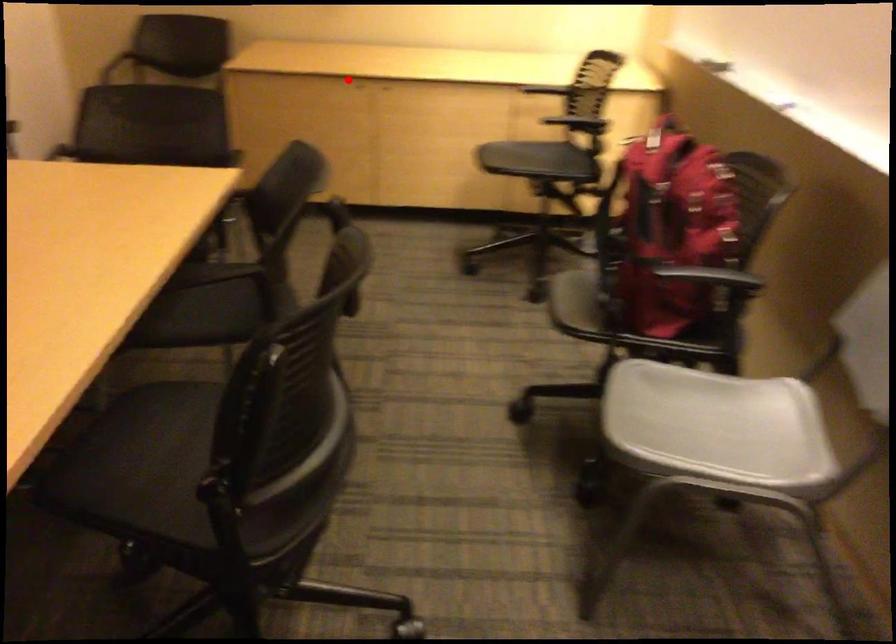
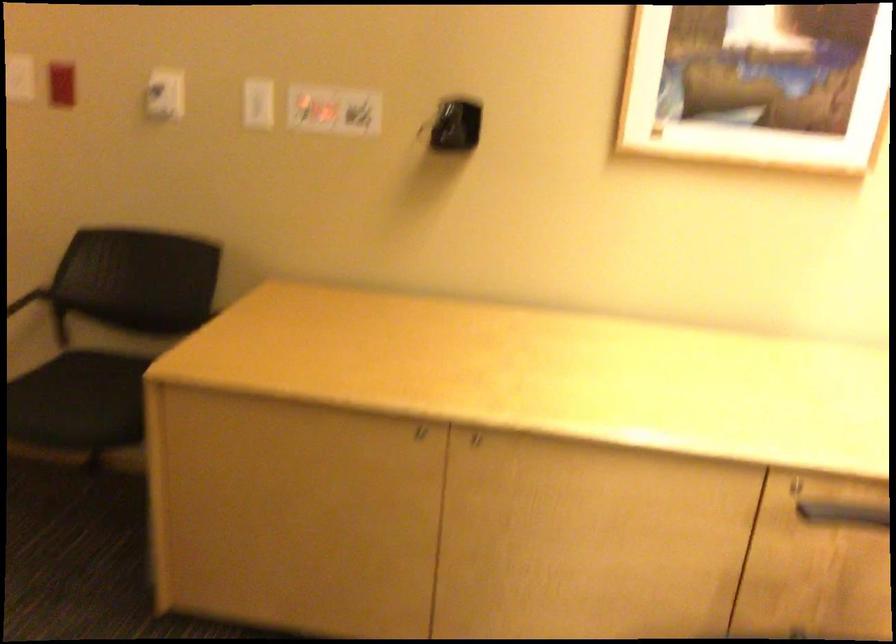
Question: I am providing you with two images of the same scene from different viewpoints. A red point is marked on the first image. Can you still see the location of the red point in image 2?

Choices:
 (A) Yes
 (B) No

Answer: (A)